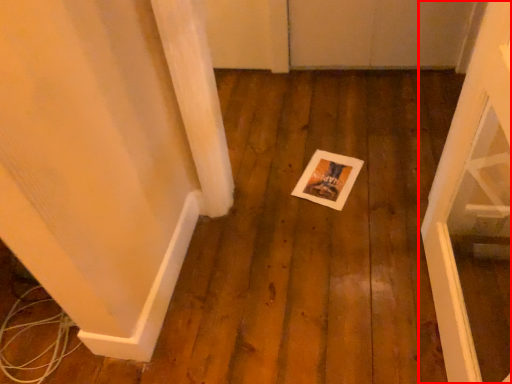
Question: From the image's perspective, where is door (annotated by the red box) located in relation to postcard in the image?

Choices:
 (A) below
 (B) above

Answer: (A)